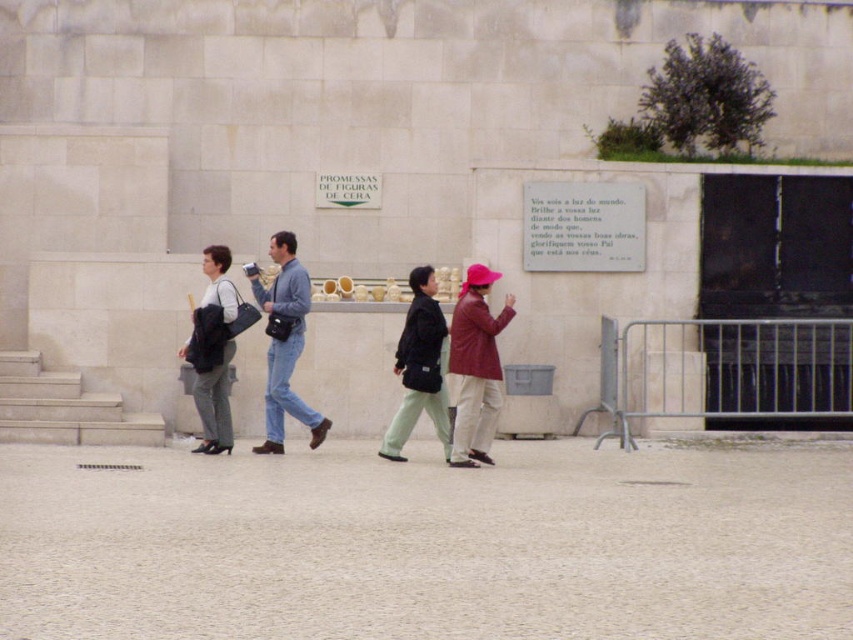
You are a photographer trying to capture a photo of the denim jeans at center and the matte black bag at left. Based on their positions, which object is closer to the left side of the image?

The matte black bag at left is closer to the left side of the image since the denim jeans at center is positioned on its right side.

You are a photographer trying to capture a photo of the matte pink hat at center and the matte black bag at left. Based on their positions, which object is closer to the camera?

The matte pink hat at center is closer to the camera because it is in front of the matte black bag at left.